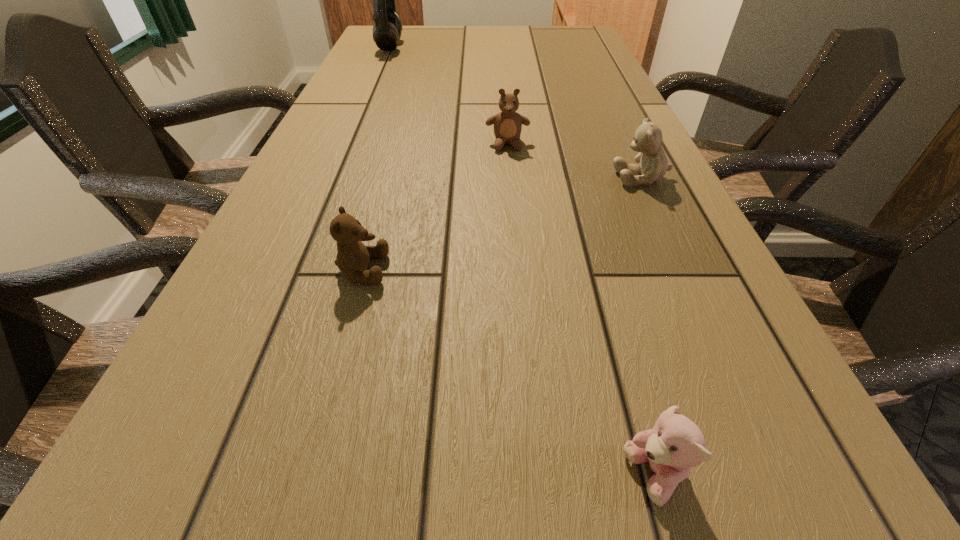
This screenshot has height=540, width=960. Find the location of `headset that is at the left edge`. headset that is at the left edge is located at coordinates (387, 29).

In order to click on teddy bear situated at the left edge in this screenshot , I will do point(353,257).

Where is `object that is at the right edge`? The image size is (960, 540). object that is at the right edge is located at coordinates (x=653, y=165).

Identify the location of object that is at the far left corner. (387, 29).

The image size is (960, 540). I want to click on vacant space at the far edge of the desktop, so click(440, 29).

In the image, there is a desktop. Identify the location of vacant space at the left edge. The width and height of the screenshot is (960, 540). (271, 234).

This screenshot has height=540, width=960. In the image, there is a desktop. What are the coordinates of `vacant space at the right edge` in the screenshot? It's located at (659, 230).

Where is `free space at the far left corner of the desktop`? free space at the far left corner of the desktop is located at coordinates (372, 40).

Locate an element on the screen. Image resolution: width=960 pixels, height=540 pixels. vacant space at the far right corner of the desktop is located at coordinates (583, 30).

Locate an element on the screen. This screenshot has width=960, height=540. vacant area between the nearest object and the farthest object is located at coordinates (522, 261).